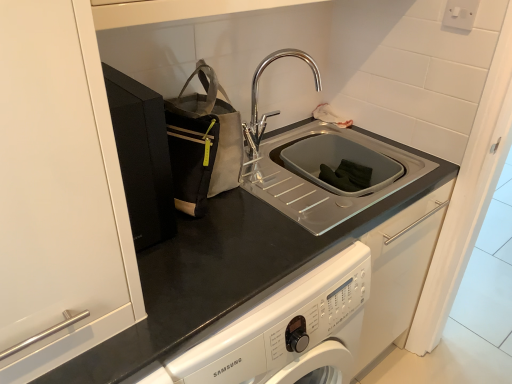
Question: Considering the relative positions of chrome metallic faucet at upper center and gray fabric tote at upper left in the image provided, is chrome metallic faucet at upper center behind gray fabric tote at upper left?

Choices:
 (A) no
 (B) yes

Answer: (B)

Question: Does chrome metallic faucet at upper center contain gray fabric tote at upper left?

Choices:
 (A) yes
 (B) no

Answer: (B)

Question: Considering the relative sizes of chrome metallic faucet at upper center and gray fabric tote at upper left in the image provided, is chrome metallic faucet at upper center wider than gray fabric tote at upper left?

Choices:
 (A) no
 (B) yes

Answer: (A)

Question: Considering the relative positions of chrome metallic faucet at upper center and gray fabric tote at upper left in the image provided, is chrome metallic faucet at upper center to the left of gray fabric tote at upper left from the viewer's perspective?

Choices:
 (A) no
 (B) yes

Answer: (A)

Question: Considering the relative sizes of chrome metallic faucet at upper center and gray fabric tote at upper left in the image provided, is chrome metallic faucet at upper center smaller than gray fabric tote at upper left?

Choices:
 (A) no
 (B) yes

Answer: (B)

Question: Is chrome metallic faucet at upper center bigger or smaller than gray fabric tote at upper left?

Choices:
 (A) small
 (B) big

Answer: (A)

Question: From their relative heights in the image, would you say chrome metallic faucet at upper center is taller or shorter than gray fabric tote at upper left?

Choices:
 (A) short
 (B) tall

Answer: (A)

Question: Is chrome metallic faucet at upper center wider or thinner than gray fabric tote at upper left?

Choices:
 (A) wide
 (B) thin

Answer: (B)

Question: Relative to gray fabric tote at upper left, is chrome metallic faucet at upper center in front or behind?

Choices:
 (A) front
 (B) behind

Answer: (B)

Question: Considering the positions of gray fabric tote at upper left and white plastic electric outlet at upper right in the image, is gray fabric tote at upper left bigger or smaller than white plastic electric outlet at upper right?

Choices:
 (A) big
 (B) small

Answer: (A)

Question: In the image, is gray fabric tote at upper left positioned in front of or behind white plastic electric outlet at upper right?

Choices:
 (A) front
 (B) behind

Answer: (A)

Question: Looking at their shapes, would you say gray fabric tote at upper left is wider or thinner than white plastic electric outlet at upper right?

Choices:
 (A) thin
 (B) wide

Answer: (B)

Question: From the image's perspective, relative to white plastic electric outlet at upper right, is gray fabric tote at upper left above or below?

Choices:
 (A) above
 (B) below

Answer: (B)

Question: Is white plastic electric outlet at upper right to the left or to the right of chrome metallic faucet at upper center in the image?

Choices:
 (A) right
 (B) left

Answer: (A)

Question: Do you think white plastic electric outlet at upper right is within chrome metallic faucet at upper center, or outside of it?

Choices:
 (A) outside
 (B) inside

Answer: (A)